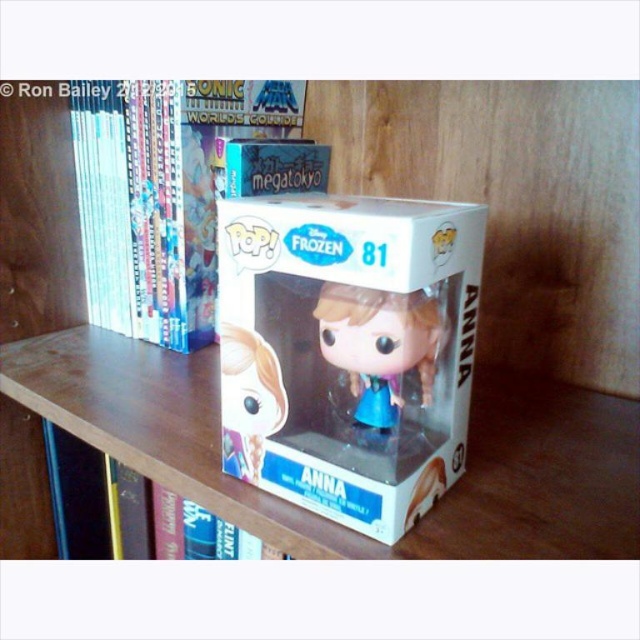
Looking at this image, you are organizing a display and need to place a new item between the white glossy box at center and the translucent plastic Anna figurine at center. Which object should you place the new item closer to if you want it to be higher up?

You should place the new item closer to the white glossy box at center because it is positioned above the translucent plastic Anna figurine at center.

Where is the white glossy box at center located in the image?

The white glossy box at center is located at point [348,349] in the image.